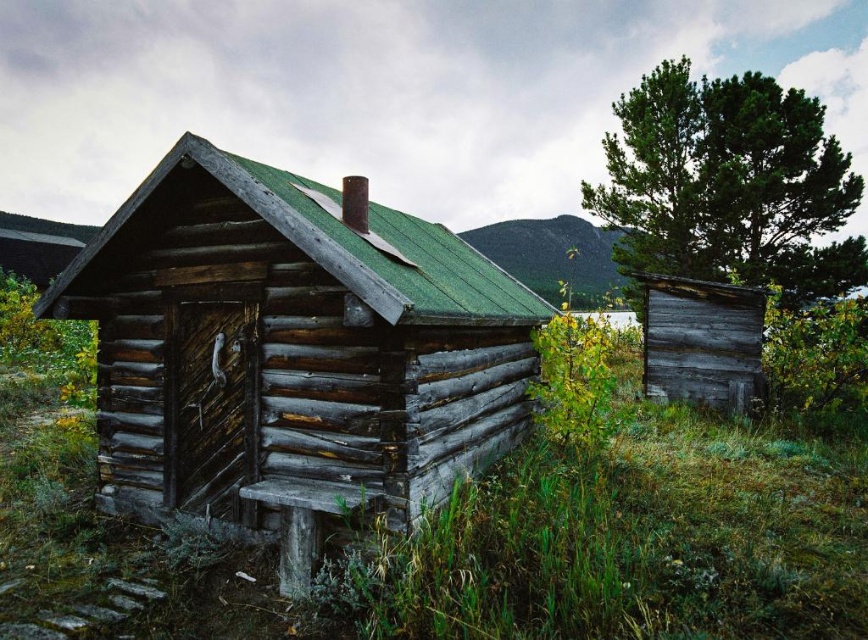
You are standing in front of the weathered wood cabin at center and want to reach the weathered wood shed at right. Which direction should you move relative to the cabin?

You should move to the right of the weathered wood cabin at center to reach the weathered wood shed at right since the shed is positioned to the right of the cabin.

You are planning to build a new shed next to the weathered wood cabin at center and the green textured tree at upper right. Based on their sizes, which one requires more space horizontally?

The green textured tree at upper right requires more horizontal space because it has a greater width than the weathered wood cabin at center.

You are standing in front of the rustic log cabin and want to access the weathered wood shed at right. However, there is a green textured tree at upper right blocking your path. Can you walk directly to the shed without going around the tree?

The weathered wood shed at right is behind the green textured tree at upper right, so you cannot walk directly to it without going around the tree.